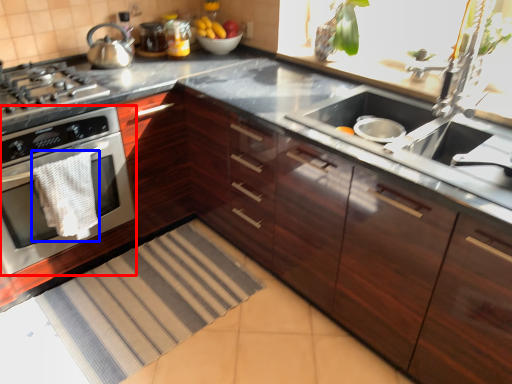
Question: Among these objects, which one is farthest to the camera, home appliance (highlighted by a red box) or material (highlighted by a blue box)?

Choices:
 (A) home appliance
 (B) material

Answer: (B)